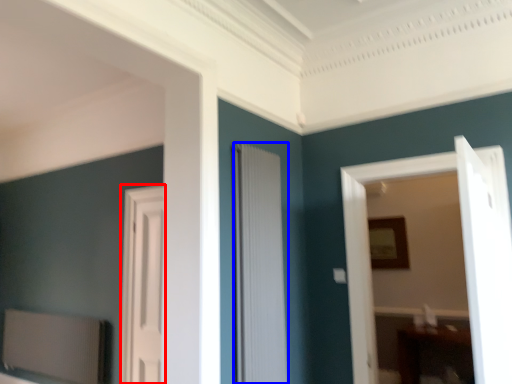
Question: Which object is further to the camera taking this photo, door (highlighted by a red box) or door (highlighted by a blue box)?

Choices:
 (A) door
 (B) door

Answer: (A)